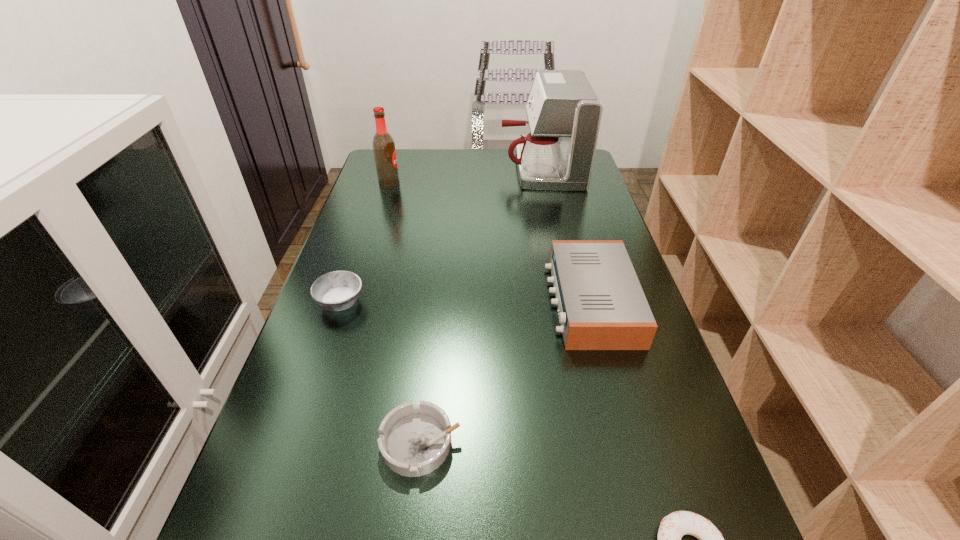
This screenshot has height=540, width=960. I want to click on coffee maker, so click(564, 114).

The image size is (960, 540). What are the coordinates of `the second tallest object` in the screenshot? It's located at (383, 144).

The width and height of the screenshot is (960, 540). I want to click on radio receiver, so click(601, 304).

In order to click on the left ashtray in this screenshot , I will do `click(338, 290)`.

Find the location of a particular element. This screenshot has width=960, height=540. the third shortest object is located at coordinates (338, 290).

This screenshot has height=540, width=960. Identify the location of the nearer ashtray. (414, 440).

I want to click on the second nearest object, so click(414, 440).

I want to click on vacant space situated on the front of the coffee maker near the spout, so click(454, 169).

Where is `vacant space situated on the front of the coffee maker near the spout`? Image resolution: width=960 pixels, height=540 pixels. vacant space situated on the front of the coffee maker near the spout is located at coordinates (469, 169).

At what (x,y) coordinates should I click in order to perform the action: click on free space located 0.380m on the front of the coffee maker near the spout. Please return your answer as a coordinate pair (x, y). This screenshot has width=960, height=540. Looking at the image, I should click on (391, 169).